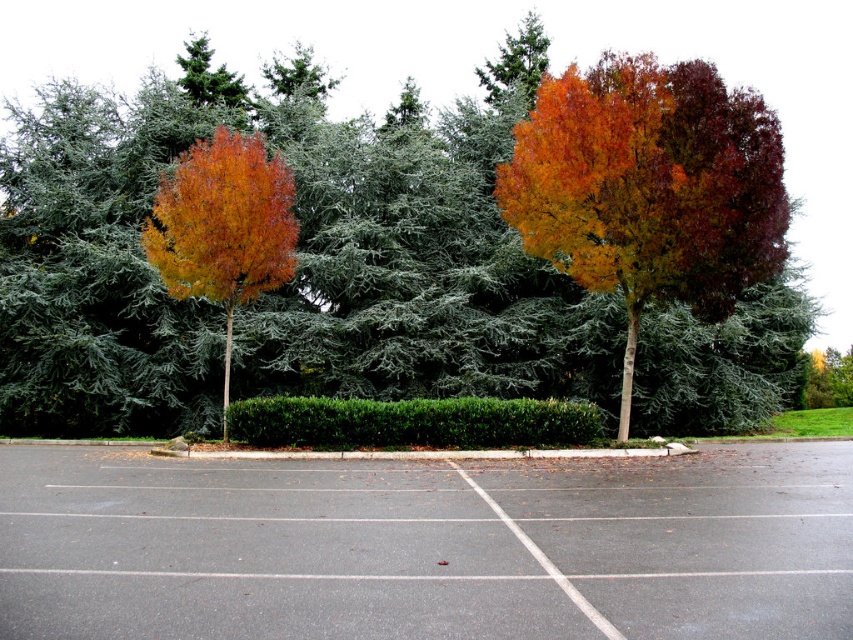
You are standing at the point marked by the coordinates point (427, 545) in the parking lot. What surface are you currently standing on?

The point (427, 545) indicates gray asphalt parking lot at center, so you are standing on the gray asphalt parking lot at center.

You are a gardener planning to water the green leafy hedge at center and the gray asphalt parking lot at center. Since the parking lot is paved, you only need to water the hedge. However, you want to ensure you water the hedge first. Given their positions, which object should you approach first if you are standing to the left of both objects?

You should approach the green leafy hedge at center first because it is on the left side of the gray asphalt parking lot at center, so it is closer to your starting position on the left.

You are standing in the parking lot and want to walk from point A to point B. Point A is located at coordinate point (424, 396) and point B is at coordinate point (260, 260). Since both points are marked on the parking lot map, which direction should you move to reach point B from point A?

To reach point B from point A, you should move towards the direction away from the camera since point A is further to the camera than point B.